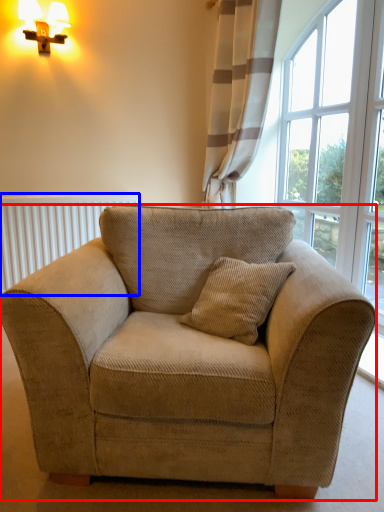
Question: Which object appears closest to the camera in this image, studio couch (highlighted by a red box) or radiator (highlighted by a blue box)?

Choices:
 (A) studio couch
 (B) radiator

Answer: (A)